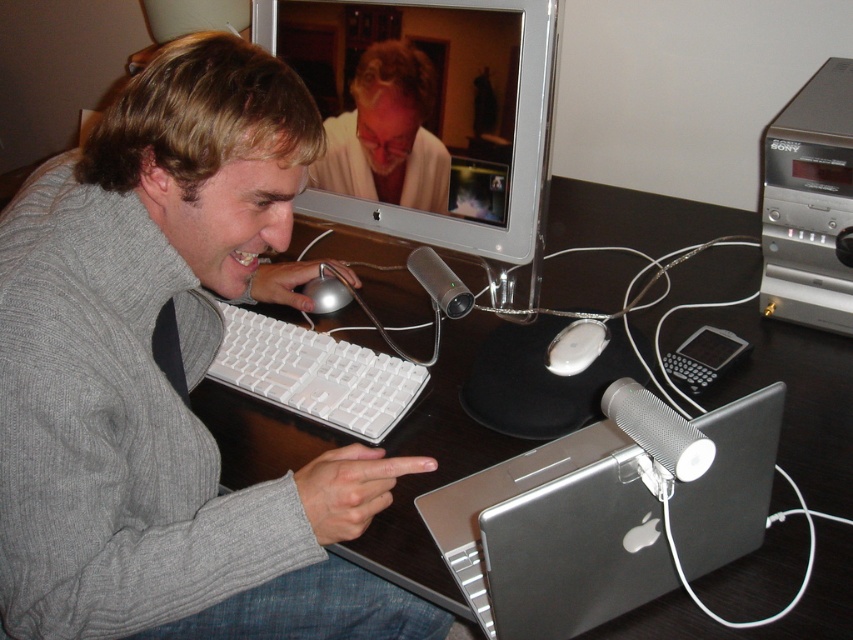
Question: Which point is closer to the camera?

Choices:
 (A) (328, 300)
 (B) (770, 248)
 (C) (585, 353)

Answer: (C)

Question: Can you confirm if gray sweater at center is positioned to the right of silver metallic laptop at center?

Choices:
 (A) no
 (B) yes

Answer: (A)

Question: Is black glossy computer desk at center to the right of white matte mouse at center from the viewer's perspective?

Choices:
 (A) yes
 (B) no

Answer: (A)

Question: Does black glossy computer desk at center have a lesser width compared to matte white shirt at upper center?

Choices:
 (A) yes
 (B) no

Answer: (B)

Question: Which of the following is the farthest from the observer?

Choices:
 (A) (602, 337)
 (B) (805, 230)
 (C) (242, 330)

Answer: (C)

Question: Which object is farther from the camera taking this photo?

Choices:
 (A) black glossy computer desk at center
 (B) silver metallic desktop computer at upper right

Answer: (B)